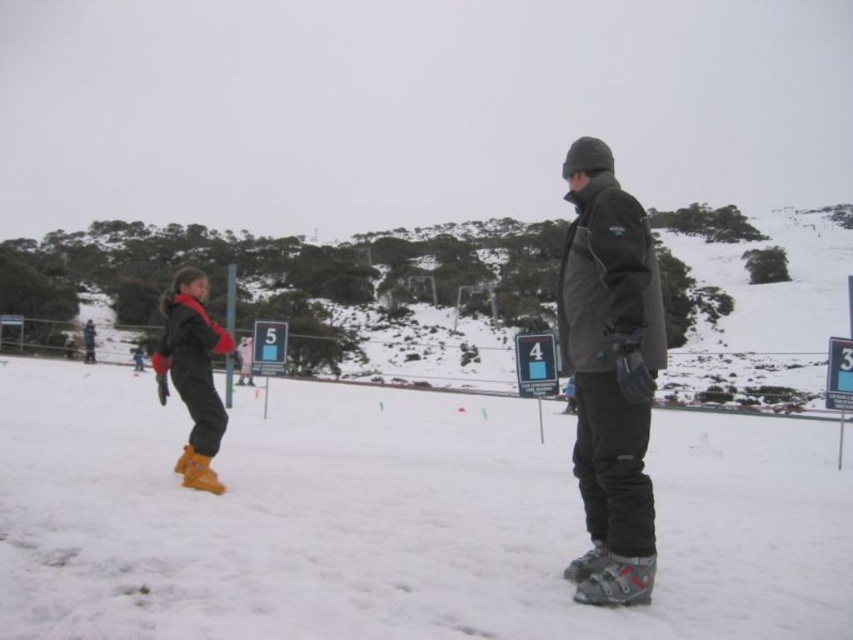
You are a photographer trying to capture a photo of both the dark gray matte jacket at center and the matte yellow ski boots at lower left. Since you want them both in focus, you need to know which object is closer to you. Which one is closer?

The dark gray matte jacket at center is closer to you because it is in front of the matte yellow ski boots at lower left.

You are standing at the point labeled as point (640, 428) and want to move towards the point labeled as point (790, 253). Which direction should you move in to get closer to your destination?

You should move forward because point (790, 253) is further to the viewer than point (640, 428), meaning it is closer to you. Moving forward will bring you closer to it.

Looking at this image, you are a ski instructor planning to move from the snowy ski slope at center to the matte yellow ski boots at lower left. Given that the minimum safe distance for a beginner skier is 30 feet, can you safely make this move?

The distance between the snowy ski slope at center and the matte yellow ski boots at lower left is 42.03 feet, which exceeds the minimum safe distance of 30 feet. Therefore, you can safely make the move.